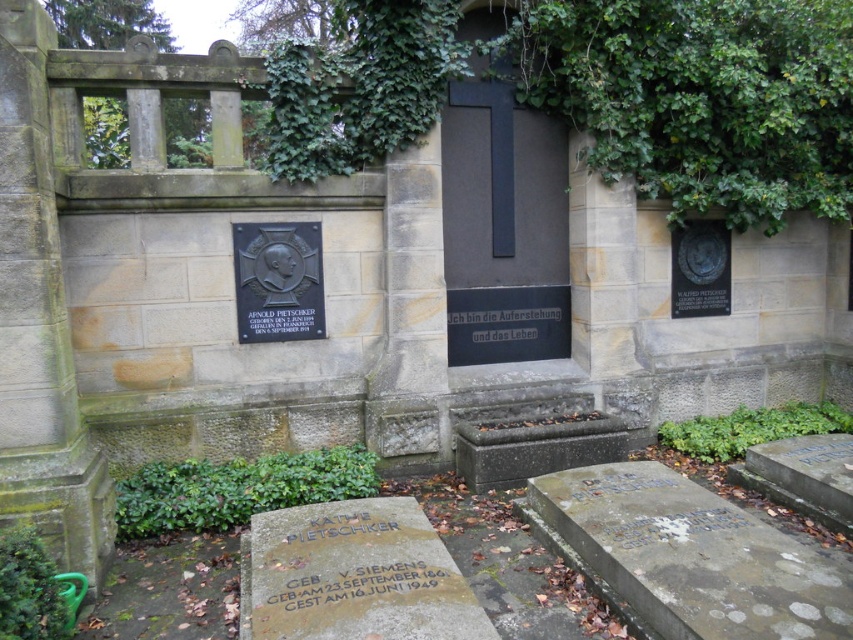
You are standing in front of the cemetery wall and want to touch the black metal plaque at center left and the bronze plaque at center. Which one would you need to reach out further to touch?

The bronze plaque at center is further away from you than the black metal plaque at center left, so you would need to reach out further to touch the bronze plaque at center.

From the picture: You are a historian examining the cemetery wall. You need to determine which object has a larger size between the white stone inscription at lower right and the bronze plaque at center. Which one is bigger?

The white stone inscription at lower right has a larger size compared to bronze plaque at center, so the white stone inscription at lower right is bigger.

You are a maintenance worker tasked with checking the plaques on the cemetery wall. You notice two plaques on the wall in front of you. Which one is bigger between the black metal plaque at center left and the bronze plaque at center?

The black metal plaque at center left has a larger size compared to the bronze plaque at center, so the black metal plaque at center left is bigger.